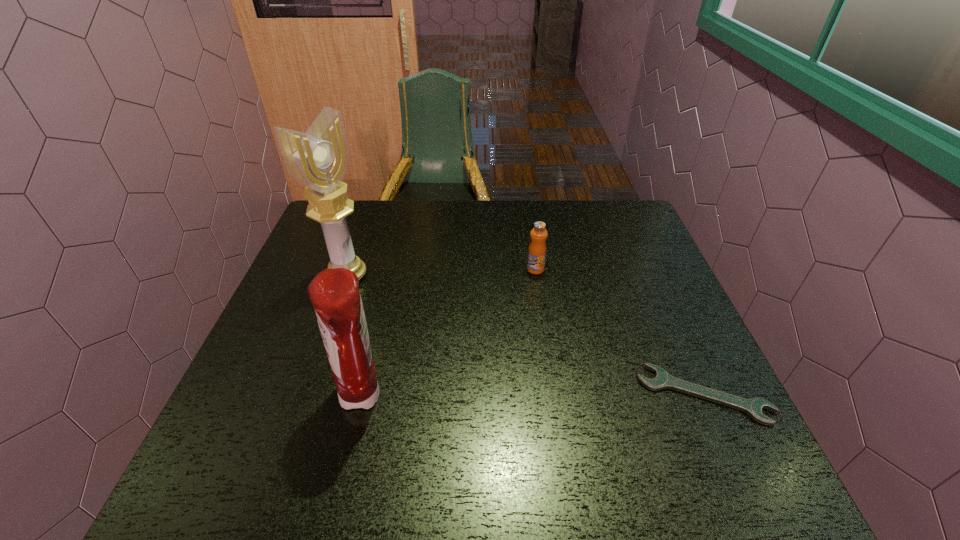
The height and width of the screenshot is (540, 960). Find the location of `free space on the desktop that is between the third shortest object and the wrench and is positioned on the front label of the orange juice`. free space on the desktop that is between the third shortest object and the wrench and is positioned on the front label of the orange juice is located at coordinates (499, 395).

Locate an element on the screen. This screenshot has height=540, width=960. vacant spot on the desktop that is between the second tallest object and the wrench and is positioned on the front-facing side of the leftmost object is located at coordinates (568, 395).